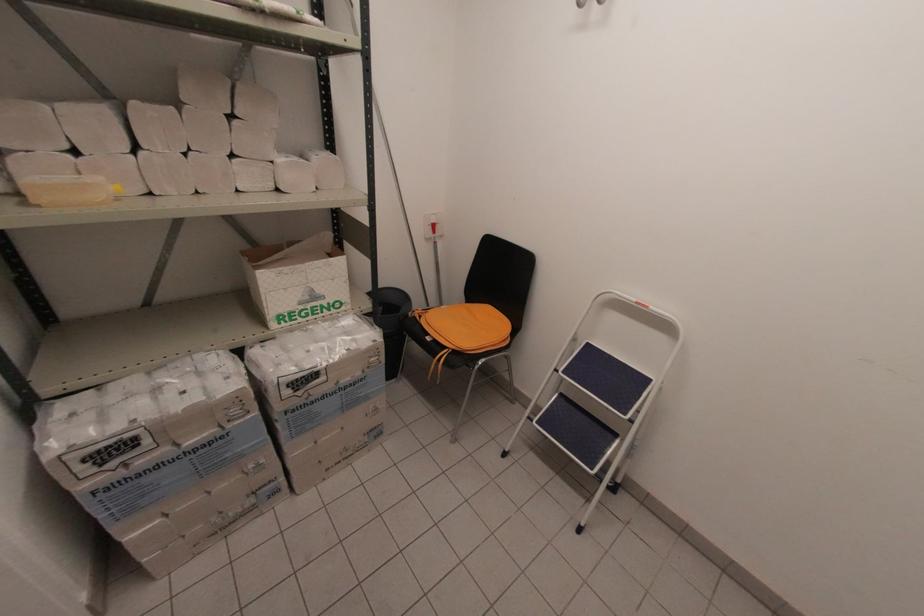
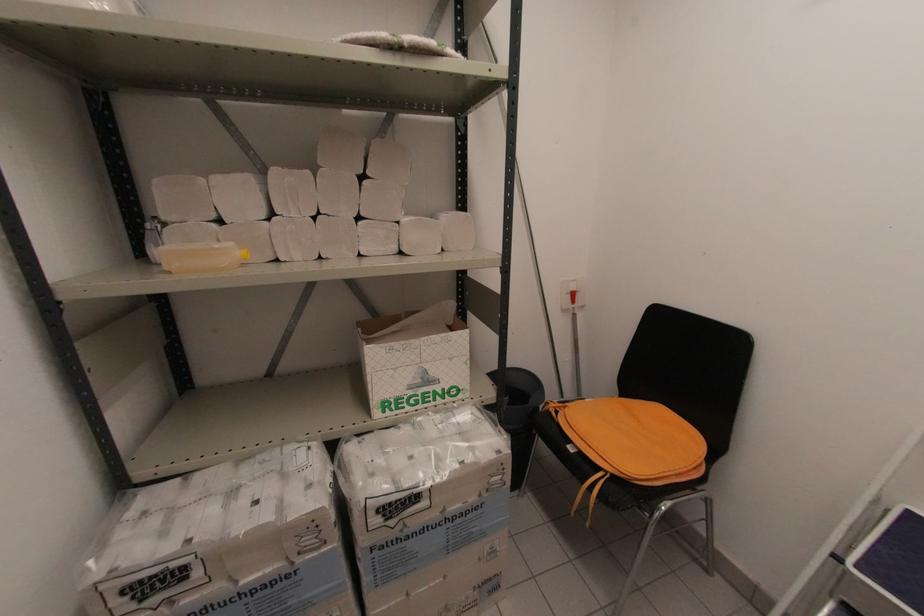
In a continuous first-person perspective shot, in which direction is the camera moving?

The movement direction of the cameraman is left, forward.